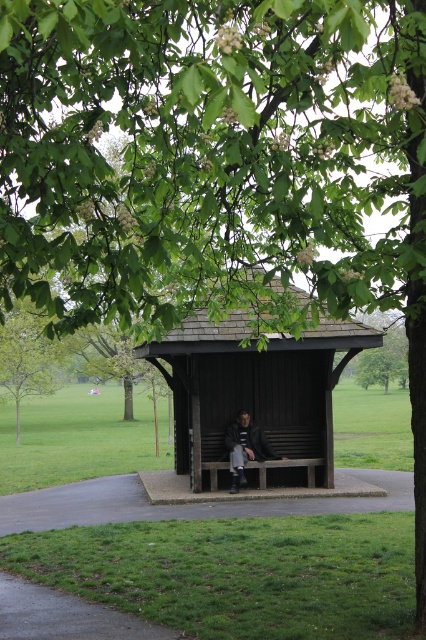
Based on the photo, you are standing at point (34, 358) and want to walk to the shelter in the park. Is the shelter located in front of or behind your current position relative to point (307, 332)?

The shelter is located in front of your current position at point (34, 358) because point (307, 332) is in front of point (34, 358), and the shelter is at point (307, 332).